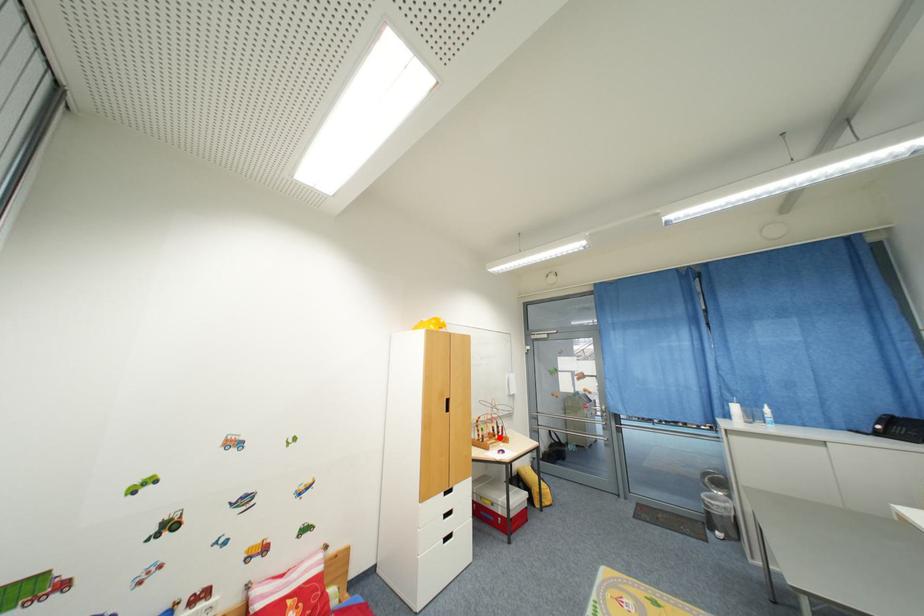
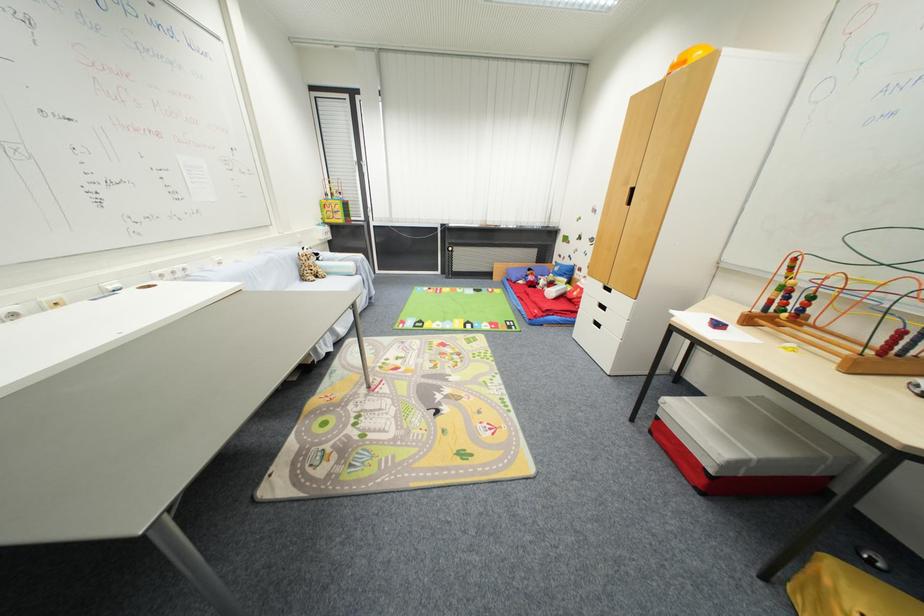
Question: I am providing you with two images of the same scene from different viewpoints. Image1 has a red point marked. In image2, the corresponding 3D location appears at what relative position? Reply with the corresponding letter.

Choices:
 (A) Closer
 (B) Farther

Answer: (A)